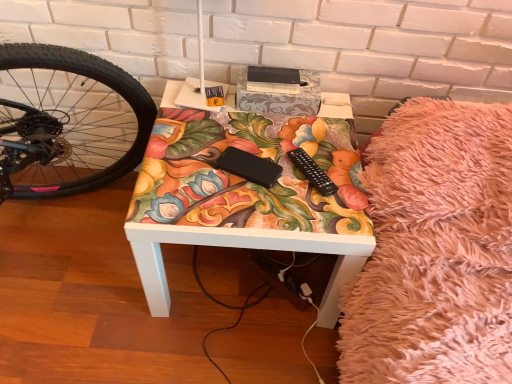
The width and height of the screenshot is (512, 384). I want to click on free area below painted wood table at center (from a real-world perspective), so click(x=221, y=278).